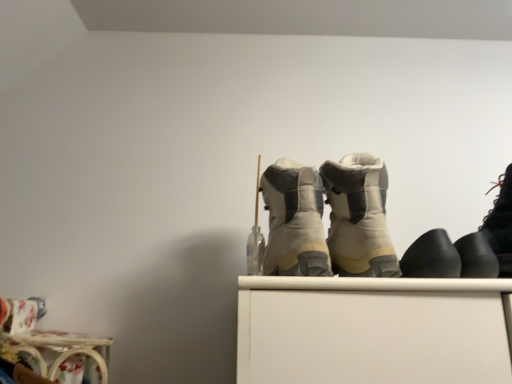
Question: Is black rubber shoes at right, which is the fourth footwear from left to right, inside the boundaries of black matte boot at right, which is the 3th footwear from left to right, or outside?

Choices:
 (A) inside
 (B) outside

Answer: (B)

Question: Considering the positions of black rubber shoes at right, which is the fourth footwear from left to right, and black matte boot at right, which is the 3th footwear from left to right, in the image, is black rubber shoes at right, which is the fourth footwear from left to right, wider or thinner than black matte boot at right, which is the 3th footwear from left to right,?

Choices:
 (A) thin
 (B) wide

Answer: (A)

Question: Which object is the closest to the black leather boot at right, positioned as the first footwear in right-to-left order?

Choices:
 (A) black rubber shoes at right, which is the fourth footwear from left to right
 (B) beige suede boots at center, placed as the fifth footwear when sorted from right to left
 (C) beige suede boots at center, which appears as the fourth footwear when viewed from the right
 (D) black matte boot at right, marked as the third footwear in a right-to-left arrangement

Answer: (A)

Question: Which of these objects is positioned farthest from the black leather boot at right, the fifth footwear positioned from the left?

Choices:
 (A) black rubber shoes at right, the 2th footwear positioned from the right
 (B) beige suede boots at center, placed as the fifth footwear when sorted from right to left
 (C) beige suede boots at center, positioned as the second footwear in left-to-right order
 (D) black matte boot at right, which is the 3th footwear from left to right

Answer: (B)